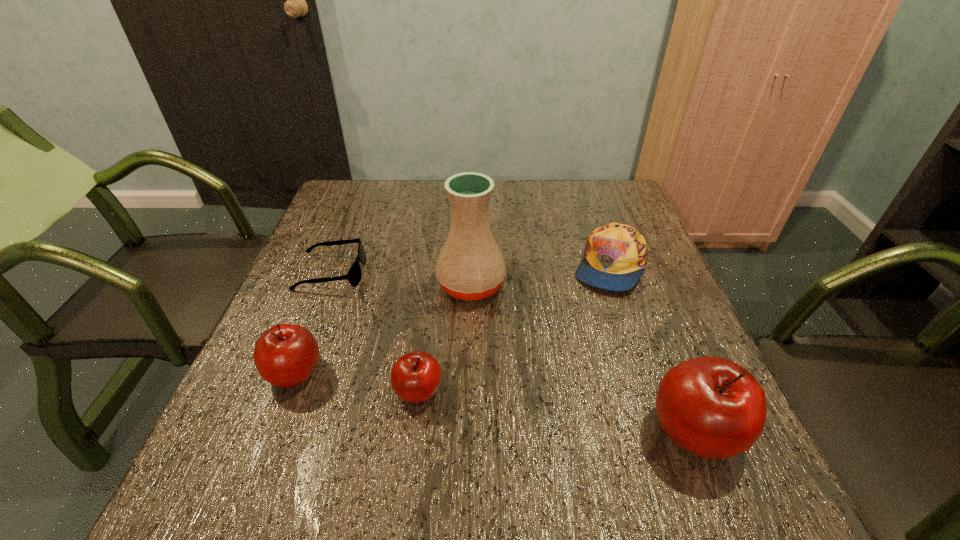
Find the location of a particular element. Image resolution: width=960 pixels, height=540 pixels. free space between the second apple from left to right and the shortest object is located at coordinates (374, 332).

Where is `blank region between the second apple from right to left and the second shortest apple`? blank region between the second apple from right to left and the second shortest apple is located at coordinates (356, 382).

The width and height of the screenshot is (960, 540). What are the coordinates of `free space between the leftmost apple and the tallest object` in the screenshot? It's located at (383, 329).

Find the location of `free space between the tallest object and the second apple from left to right`. free space between the tallest object and the second apple from left to right is located at coordinates (444, 338).

Where is `empty space between the shortest apple and the shortest object`? This screenshot has height=540, width=960. empty space between the shortest apple and the shortest object is located at coordinates (374, 332).

At what (x,y) coordinates should I click in order to perform the action: click on vacant point located between the tallest object and the rightmost apple. Please return your answer as a coordinate pair (x, y). This screenshot has width=960, height=540. Looking at the image, I should click on coord(583,358).

Identify which object is the fourth closest to the shortest object. Please provide its 2D coordinates. Your answer should be formatted as a tuple, i.e. [(x, y)], where the tuple contains the x and y coordinates of a point satisfying the conditions above.

[(616, 255)]

Image resolution: width=960 pixels, height=540 pixels. I want to click on object that ranks as the fourth closest to the tallest apple, so click(x=285, y=355).

The image size is (960, 540). I want to click on the closest apple to the rightmost apple, so (x=415, y=377).

Locate an element on the screen. This screenshot has height=540, width=960. apple that is the second closest one to the tallest apple is located at coordinates tap(285, 355).